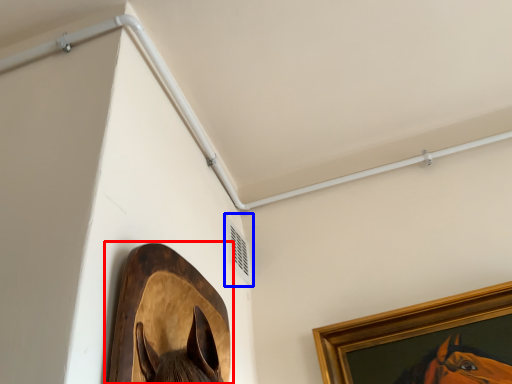
Question: Which object is closer to the camera taking this photo, picture frame (highlighted by a red box) or air conditioning (highlighted by a blue box)?

Choices:
 (A) picture frame
 (B) air conditioning

Answer: (A)